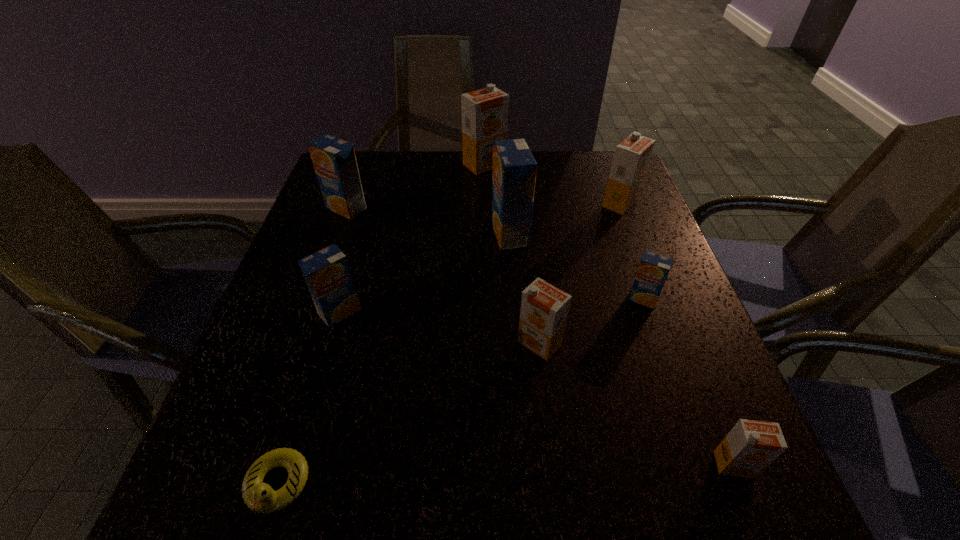
Locate which object is the fifth closest to the third blue orange_juice from left to right. Please provide its 2D coordinates. Your answer should be formatted as a tuple, i.e. [(x, y)], where the tuple contains the x and y coordinates of a point satisfying the conditions above.

[(327, 273)]

In order to click on object that stands as the third closest to the second smallest orange orange juice in this screenshot , I will do `click(751, 446)`.

Find the location of `orange juice that stands as the fourth closest to the smallest blue orange_juice`. orange juice that stands as the fourth closest to the smallest blue orange_juice is located at coordinates (751, 446).

Identify the location of the second closest orange juice to the third blue orange_juice from left to right. (631, 158).

I want to click on orange orange juice that can be found as the fourth closest to the second smallest blue orange_juice, so click(x=751, y=446).

Where is `the second closest orange orange juice to the farthest orange juice`? the second closest orange orange juice to the farthest orange juice is located at coordinates (544, 308).

Identify which blue orange_juice is located as the third nearest to the shortest object. Please provide its 2D coordinates. Your answer should be formatted as a tuple, i.e. [(x, y)], where the tuple contains the x and y coordinates of a point satisfying the conditions above.

[(334, 160)]

Choose which blue orange_juice is the fourth nearest neighbor to the duckling. Please provide its 2D coordinates. Your answer should be formatted as a tuple, i.e. [(x, y)], where the tuple contains the x and y coordinates of a point satisfying the conditions above.

[(653, 270)]